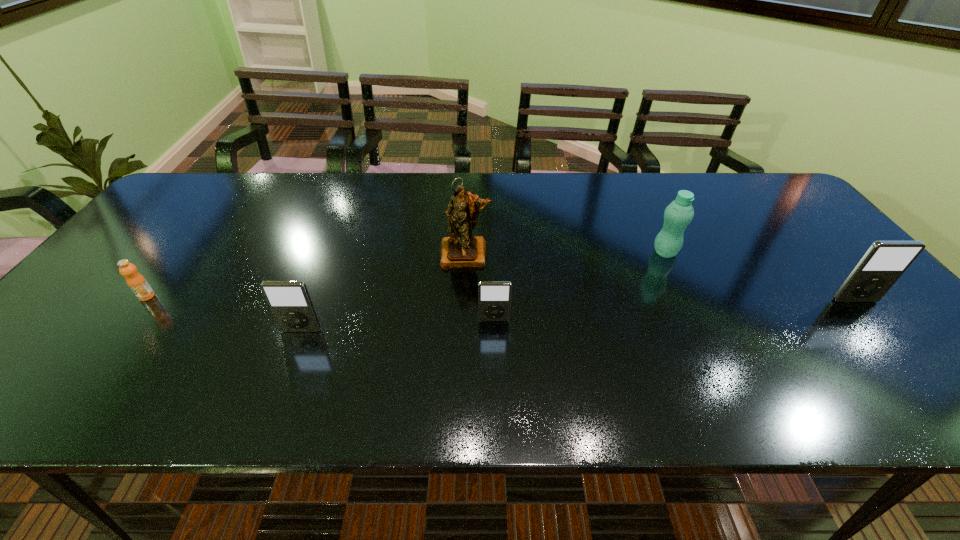
Where is `the second shortest iPod`? the second shortest iPod is located at coordinates (289, 301).

Identify the location of the third shortest object. (289, 301).

This screenshot has width=960, height=540. I want to click on the second nearest iPod, so click(x=494, y=297).

The image size is (960, 540). I want to click on the fifth farthest object, so click(494, 297).

Locate an element on the screen. The image size is (960, 540). the tallest iPod is located at coordinates (884, 262).

Find the location of a particular element. Image resolution: width=960 pixels, height=540 pixels. the rightmost object is located at coordinates pos(884,262).

This screenshot has height=540, width=960. I want to click on orange juice, so (x=137, y=283).

This screenshot has width=960, height=540. I want to click on bottle, so click(x=679, y=213).

Where is `the tallest object`? The image size is (960, 540). the tallest object is located at coordinates (461, 249).

Locate an element on the screen. The width and height of the screenshot is (960, 540). free space located 0.060m on the front-facing side of the third shortest object is located at coordinates (292, 355).